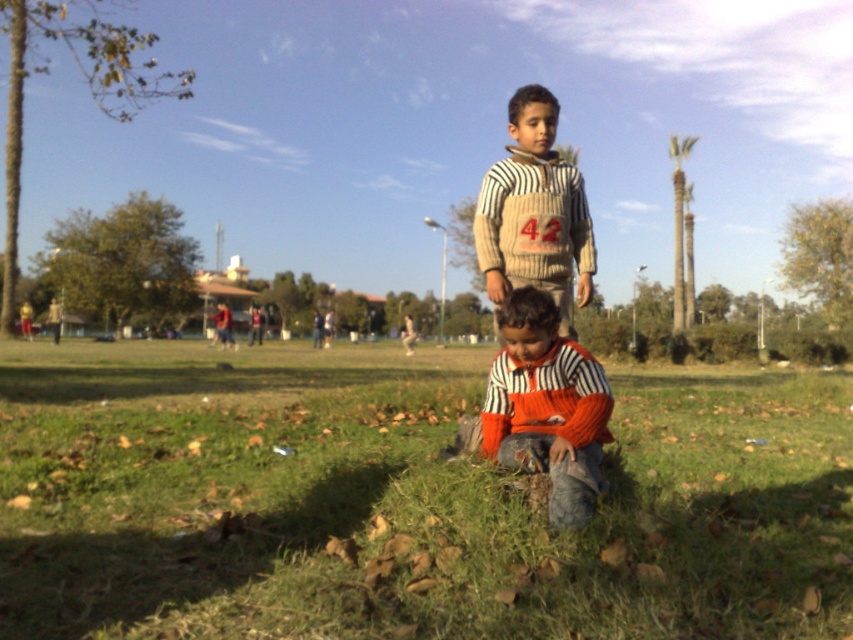
Question: Does green grass at center have a smaller size compared to striped wool sweater at center?

Choices:
 (A) yes
 (B) no

Answer: (B)

Question: Is green grass at center wider than striped sweater at center?

Choices:
 (A) no
 (B) yes

Answer: (B)

Question: Which point is closer to the camera taking this photo?

Choices:
 (A) (798, 429)
 (B) (479, 228)
 (C) (555, 504)

Answer: (C)

Question: Does green grass at center have a larger size compared to striped sweater at center?

Choices:
 (A) yes
 (B) no

Answer: (A)

Question: Which point is closer to the camera?

Choices:
 (A) striped wool sweater at center
 (B) striped sweater at center
 (C) green grass at center

Answer: (C)

Question: Which point appears closest to the camera in this image?

Choices:
 (A) (132, 467)
 (B) (534, 166)
 (C) (555, 504)

Answer: (C)